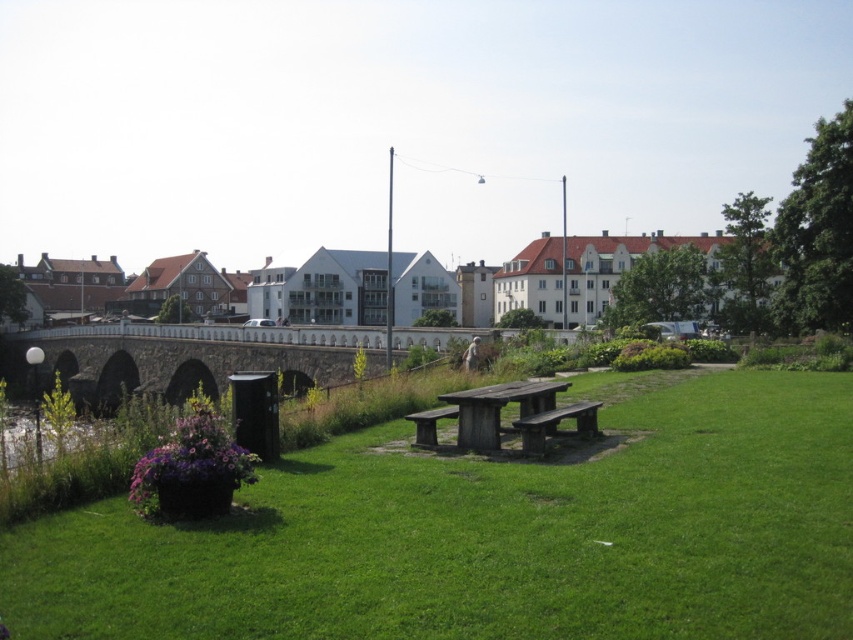
Is stone arch bridge at center bigger than wooden bench at center?

Indeed, stone arch bridge at center has a larger size compared to wooden bench at center.

Who is more forward, (219, 356) or (444, 416)?

Positioned in front is point (444, 416).

Image resolution: width=853 pixels, height=640 pixels. What are the coordinates of `stone arch bridge at center` in the screenshot? It's located at (184, 358).

Is point (308, 355) positioned behind point (550, 420)?

Yes.

Does stone arch bridge at center appear under wooden park bench at center?

Indeed, stone arch bridge at center is positioned under wooden park bench at center.

Measure the distance between point (68, 339) and camera.

The distance of point (68, 339) from camera is 143.13 meters.

Find the location of `stone arch bridge at center`. stone arch bridge at center is located at coordinates (184, 358).

Measure the distance between stone arch bridge at center and wooden picnic table at center.

stone arch bridge at center and wooden picnic table at center are 32.44 meters apart from each other.

Measure the distance between point (171, 364) and camera.

Point (171, 364) is 355.24 feet away from camera.

The image size is (853, 640). I want to click on stone arch bridge at center, so click(x=184, y=358).

Find the location of `stone arch bridge at center`. stone arch bridge at center is located at coordinates (184, 358).